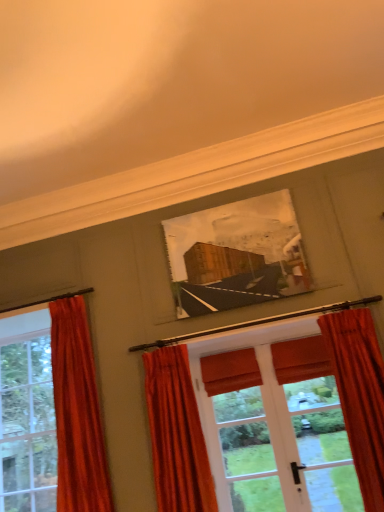
Image resolution: width=384 pixels, height=512 pixels. Identify the location of blank space situated above wooden picture frame at center (from a real-world perspective). (217, 204).